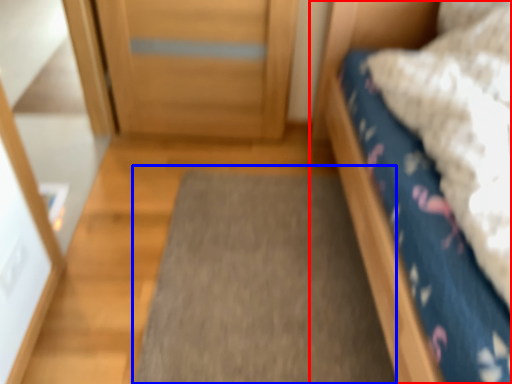
Question: Which point is closer to the camera, bed (highlighted by a red box) or doormat (highlighted by a blue box)?

Choices:
 (A) bed
 (B) doormat

Answer: (A)